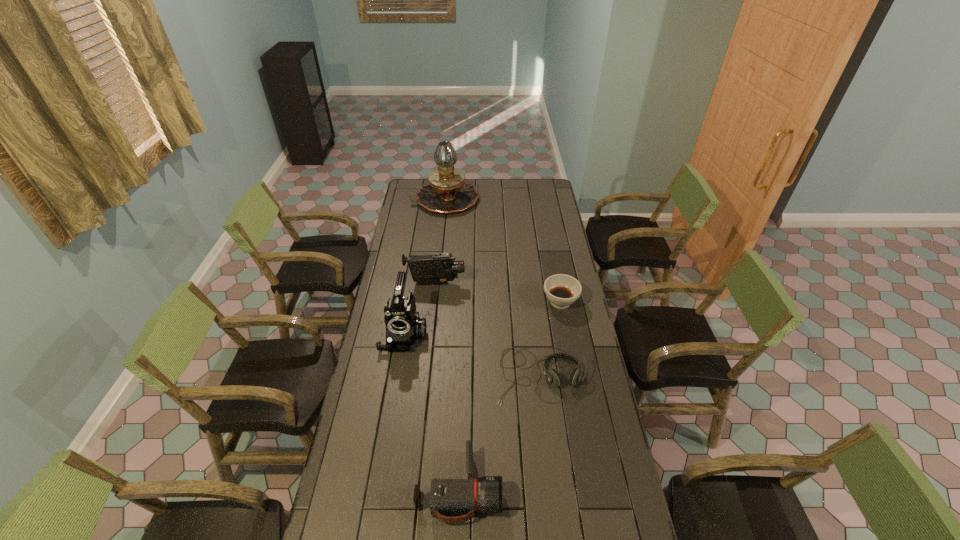
Locate an element on the screen. The image size is (960, 540). vacant space that's between the tallest camcorder and the soup bowl is located at coordinates click(482, 318).

Locate an element on the screen. vacant space that's between the shortest camcorder and the farthest object is located at coordinates (452, 344).

Locate an element on the screen. free area in between the soup bowl and the shortest camcorder is located at coordinates (510, 395).

This screenshot has width=960, height=540. Identify the location of free space between the tallest object and the headset. (492, 287).

You are a GUI agent. You are given a task and a screenshot of the screen. Output one action in this format:
    pyautogui.click(x=<x>, y=<y>)
    Task: Click on the vacant area between the second shortest camcorder and the tallest camcorder
    The image size is (960, 540).
    Given the screenshot: What is the action you would take?
    pyautogui.click(x=420, y=309)

You are a GUI agent. You are given a task and a screenshot of the screen. Output one action in this format:
    pyautogui.click(x=<x>, y=<y>)
    Task: Click on the object identified as the second closest to the headset
    Image resolution: width=960 pixels, height=540 pixels.
    Given the screenshot: What is the action you would take?
    pyautogui.click(x=448, y=497)

Image resolution: width=960 pixels, height=540 pixels. What are the coordinates of `object that stands as the fifth closest to the headset` in the screenshot? It's located at (447, 192).

Identify which camcorder is the third nearest to the oil lamp. Please provide its 2D coordinates. Your answer should be formatted as a tuple, i.e. [(x, y)], where the tuple contains the x and y coordinates of a point satisfying the conditions above.

[(448, 497)]

The width and height of the screenshot is (960, 540). I want to click on camcorder object that ranks as the second closest to the fifth shortest object, so click(448, 497).

Find the location of a particular element. This screenshot has width=960, height=540. blank space that satisfies the following two spatial constraints: 1. on the front-facing side of the farthest camcorder; 2. on the back side of the soup bowl is located at coordinates pyautogui.click(x=433, y=302).